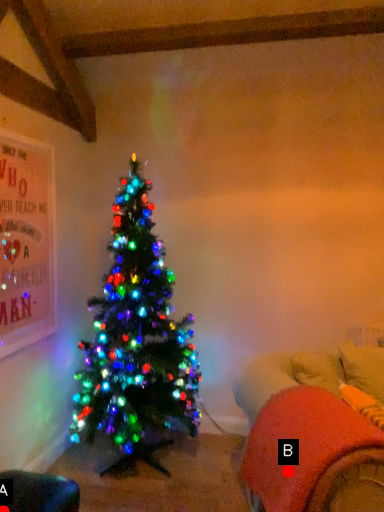
Question: Two points are circled on the image, labeled by A and B beside each circle. Which point is closer to the camera?

Choices:
 (A) A is closer
 (B) B is closer

Answer: (B)